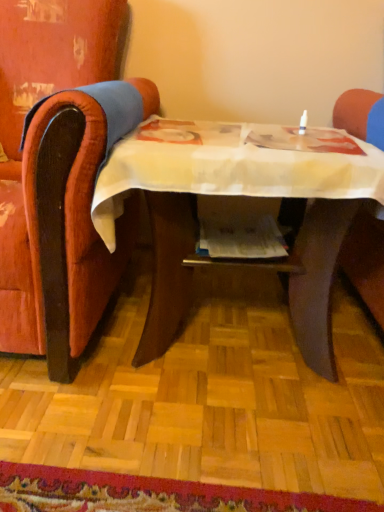
This screenshot has width=384, height=512. Find the location of `free space above wooden table at center (from a real-world perspective)`. free space above wooden table at center (from a real-world perspective) is located at coordinates (245, 138).